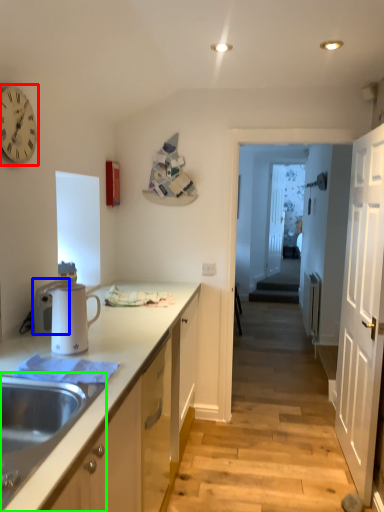
Question: Which object is the closest to the clock (highlighted by a red box)? Choose among these: appliance (highlighted by a blue box) or sink (highlighted by a green box).

Choices:
 (A) appliance
 (B) sink

Answer: (A)